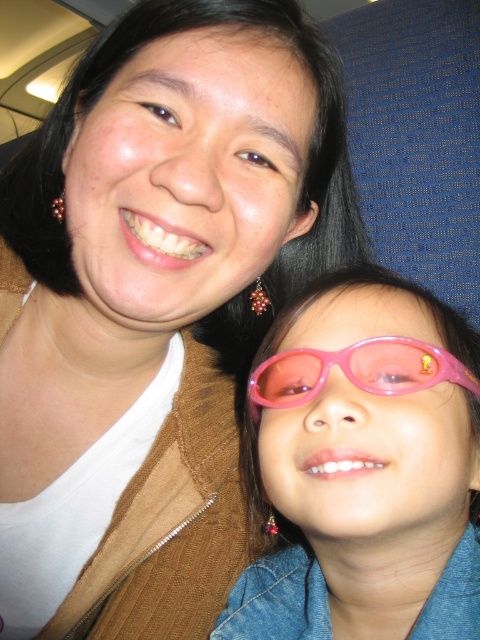
You are a photographer trying to capture the pink plastic sunglasses at lower right in the image. The sunglasses are located at coordinates point (365,467). If you move your camera slightly to the left, will the sunglasses still be in the frame?

The sunglasses are located at point (365,467). Moving the camera slightly to the left would still keep the sunglasses within the frame since the point is at the lower right, so yes, they would remain visible.

You are a delivery robot that needs to place a small package between the pink plastic sunglasses at lower right and the pink translucent goggles at lower center. The package is 2.5 inches long. Will there be enough space between them to fit the package?

The distance between the pink plastic sunglasses at lower right and the pink translucent goggles at lower center is 2.54 inches. Since the package is 2.5 inches long, it will fit with a small amount of space to spare.

You are a designer creating a display for a toy store. You need to place the pink plastic sunglasses at lower right and the pink translucent goggles at lower center on a shelf. The shelf has limited space, and the store requires that the smaller item be placed in the front for visibility. Which item should be placed in the front?

The pink translucent goggles at lower center should be placed in the front because they are smaller than the pink plastic sunglasses at lower right.